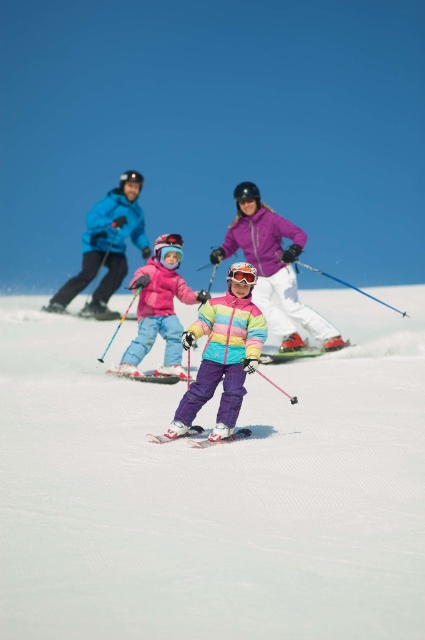
Question: Does rainbow fabric ski suit at center appear on the right side of metallic silver ski at center?

Choices:
 (A) no
 (B) yes

Answer: (B)

Question: Observing the image, what is the correct spatial positioning of blue softshell jacket at upper left in reference to green matte ski at center?

Choices:
 (A) above
 (B) below

Answer: (A)

Question: In this image, where is blue softshell jacket at upper left located relative to matte black ski at center?

Choices:
 (A) left
 (B) right

Answer: (B)

Question: Which of the following is the closest to the observer?

Choices:
 (A) matte purple ski suit at center
 (B) translucent orange goggles at center

Answer: (B)

Question: Which point appears closest to the camera in this image?

Choices:
 (A) (297, 227)
 (B) (235, 273)
 (C) (252, 492)
 (D) (139, 339)

Answer: (C)

Question: Which object appears farthest from the camera in this image?

Choices:
 (A) rainbow fabric ski suit at center
 (B) matte pink snowsuit at center
 (C) translucent orange goggles at center

Answer: (B)